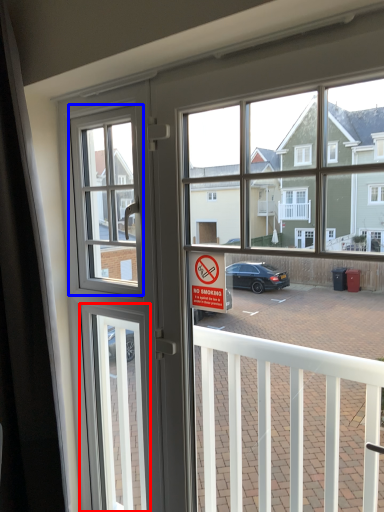
Question: Among these objects, which one is farthest to the camera, screen door (highlighted by a red box) or window screen (highlighted by a blue box)?

Choices:
 (A) screen door
 (B) window screen

Answer: (A)